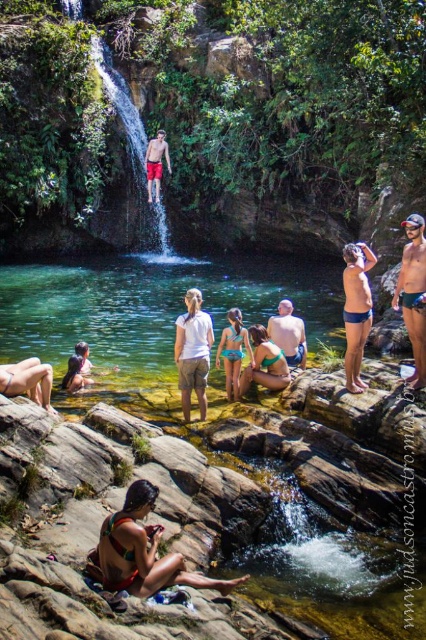
You are a photographer at the swimming hole and want to capture both the matte green bikini at center and the blue fabric swimsuit at center in the same frame. Which swimwear will appear larger in the photo?

The matte green bikini at center will appear larger in the photo because it is bigger than the blue fabric swimsuit at center.

You are a photographer positioned at the edge of the pool. You want to take a photo that includes both the white cotton shirt at center and the matte green bikini at center. Which object should you adjust to ensure both are fully visible in the frame?

Since the white cotton shirt at center is in front of the matte green bikini at center, you should move the white cotton shirt at center slightly backward or the matte green bikini at center slightly forward to ensure both are fully visible in the frame.